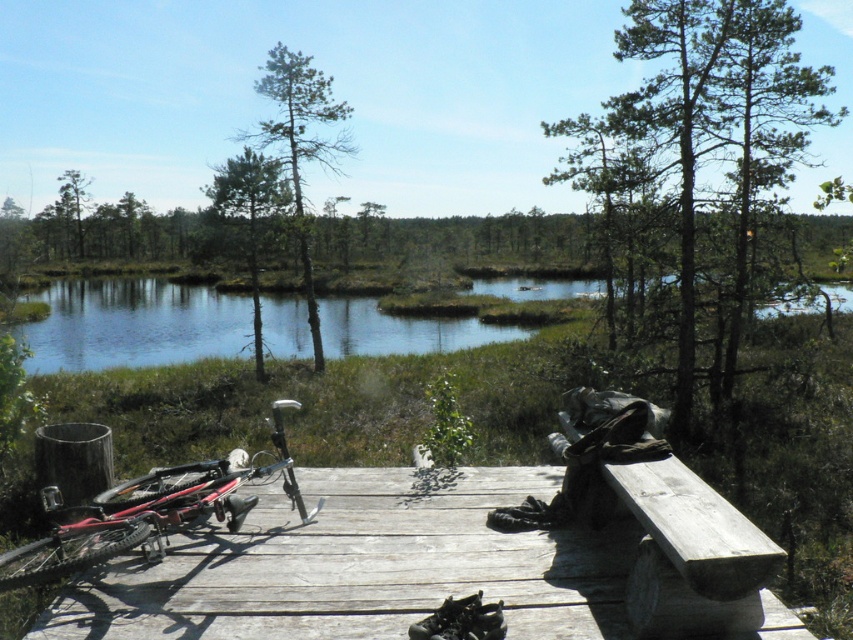
You are planning to take a short nap on the wooden platform. The red matte mountain bike at lower left and the weathered wood bench at lower right are both on the platform. Which object is closer to the ground?

The red matte mountain bike at lower left is below the weathered wood bench at lower right, so the mountain bike is closer to the ground.

You are standing on the wooden dock at lower left and want to sit down. Is the weathered wood bench at lower right accessible from your current position without moving around the dock?

The weathered wood bench at lower right is behind the wooden dock at lower left, so you cannot see or reach it directly from your current position on the wooden dock at lower left without moving around the dock to access it.

You are standing on the wooden dock at lower left and want to reach the weathered wood bench at lower right. Which direction should you move to get there?

The wooden dock at lower left is located below the weathered wood bench at lower right, so you should move upward to reach it.